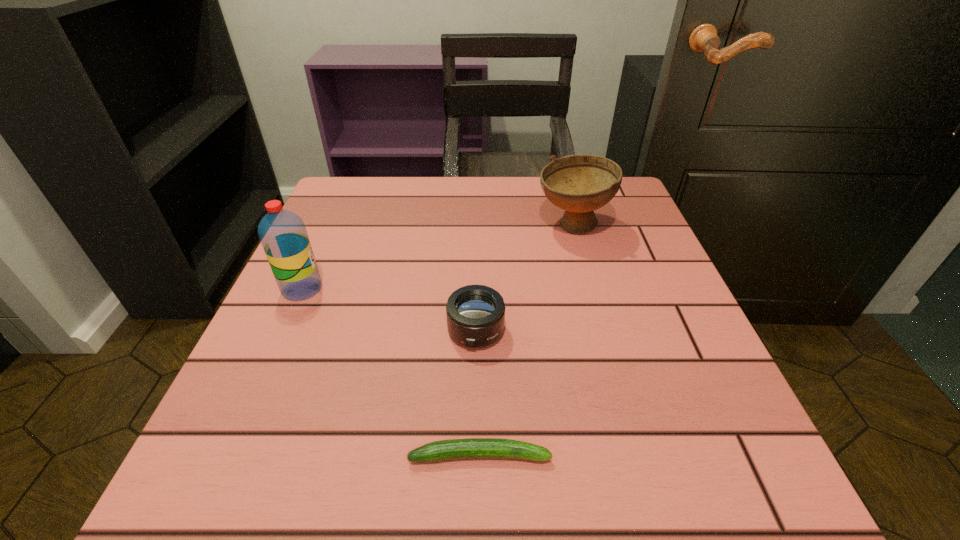
I want to click on free spot between the second nearest object and the zucchini, so click(478, 393).

Select which object appears as the closest to the tallest object. Please provide its 2D coordinates. Your answer should be formatted as a tuple, i.e. [(x, y)], where the tuple contains the x and y coordinates of a point satisfying the conditions above.

[(475, 314)]

Choose which object is the second nearest neighbor to the tallest object. Please provide its 2D coordinates. Your answer should be formatted as a tuple, i.e. [(x, y)], where the tuple contains the x and y coordinates of a point satisfying the conditions above.

[(472, 448)]